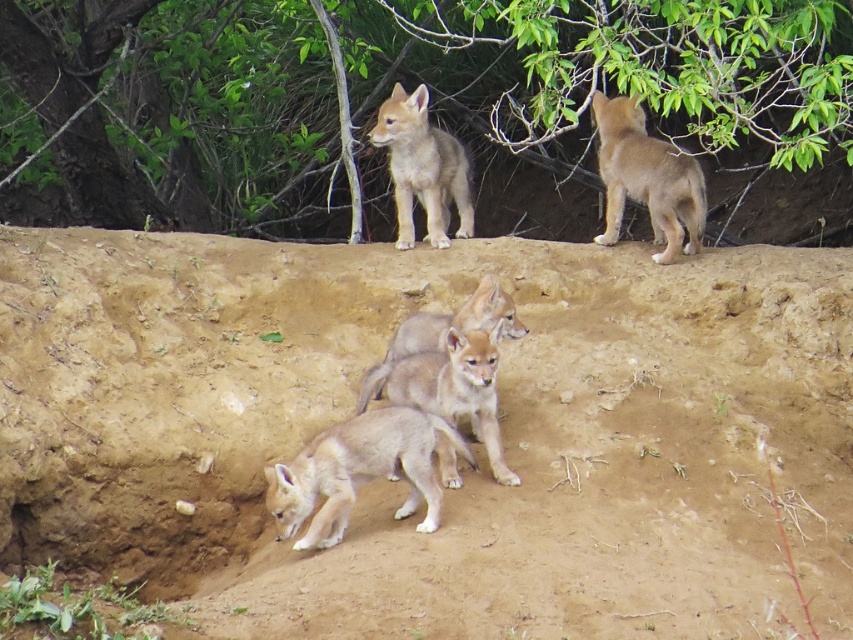
You are a wildlife photographer trying to capture a closeup of the fuzzy beige pup at lower center. You are currently standing at the point marked by the coordinate point [358,472]. Is this coordinate the best position to get a clear view of the fuzzy beige pup at lower center without any obstruction?

The point marked by the coordinate [358,472] is exactly where the fuzzy beige pup at lower center is located, so standing there would place you right at the pup, potentially obstructing the view. Move slightly to the side or behind to get a clearer shot.

You are a wildlife photographer trying to capture a photo of the fuzzy tan pup at center and the fuzzy brown coyote at upper center. Based on their positions, which animal would appear larger in your photo?

The fuzzy tan pup at center would appear larger in the photo because it is wider than the fuzzy brown coyote at upper center, making it take up more space in the frame.